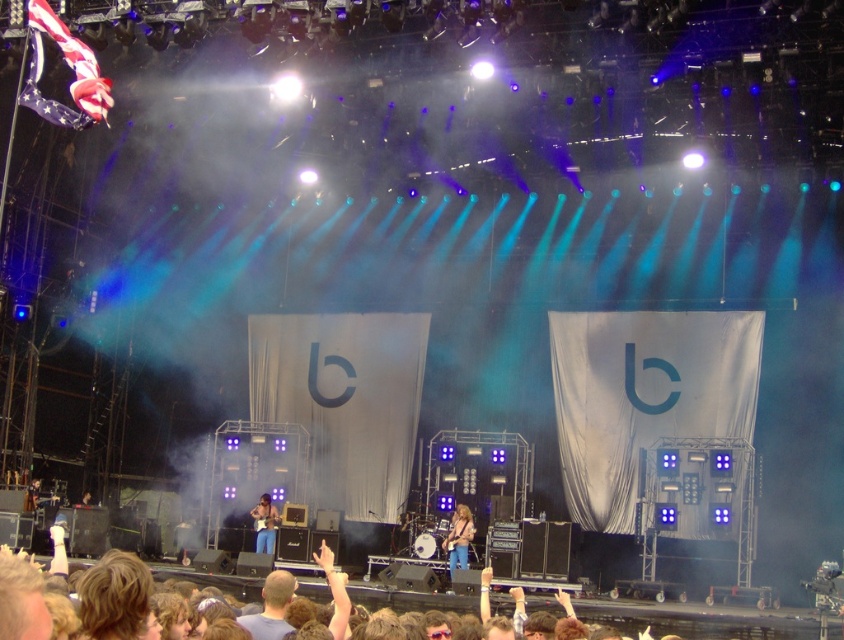
Question: From the image, what is the correct spatial relationship of blue denim jeans at center in relation to matte blue jeans at center?

Choices:
 (A) above
 (B) below

Answer: (A)

Question: Is blue denim jeans at center further to camera compared to matte blue jeans at center?

Choices:
 (A) no
 (B) yes

Answer: (A)

Question: Which object appears farthest from the camera in this image?

Choices:
 (A) matte blue jeans at center
 (B) blue jeans at center

Answer: (A)

Question: Which of the following is the farthest from the observer?

Choices:
 (A) matte blue jeans at center
 (B) blue denim jeans at center
 (C) blue jeans at center

Answer: (A)

Question: Estimate the real-world distances between objects in this image. Which object is closer to the blue jeans at center?

Choices:
 (A) blue denim jeans at center
 (B) matte blue jeans at center

Answer: (A)

Question: Is blue jeans at center further to the viewer compared to blue denim jeans at center?

Choices:
 (A) no
 (B) yes

Answer: (A)